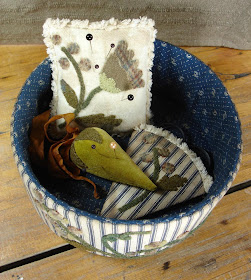
Image resolution: width=251 pixels, height=280 pixels. Find the location of `blue and white striped pattern on fabric`. blue and white striped pattern on fabric is located at coordinates (185, 169).